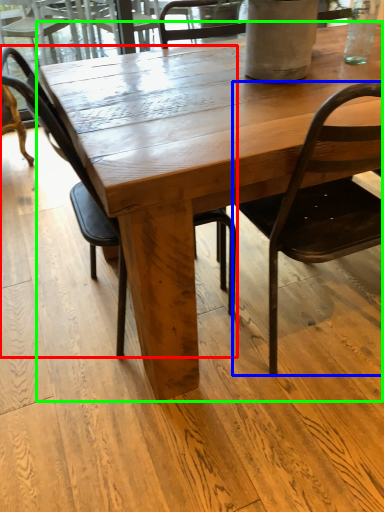
Question: Estimate the real-world distances between objects in this image. Which object is closer to chair (highlighted by a red box), chair (highlighted by a blue box) or coffee table (highlighted by a green box)?

Choices:
 (A) chair
 (B) coffee table

Answer: (B)